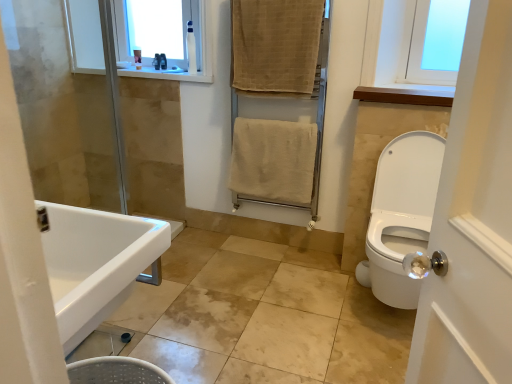
Locate an element on the screen. This screenshot has height=384, width=512. free spot above beige textured towel at upper center, the second bath towel in the bottom-to-top sequence (from a real-world perspective) is located at coordinates (273, 0).